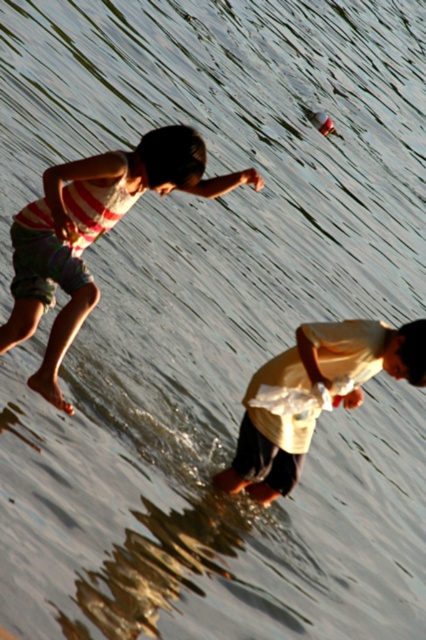
You are a photographer trying to capture the two children in the scene. The striped cotton shorts at left is located at point (x=92, y=232). Where should you position your camera to ensure both children are in frame?

To capture both children in frame, position the camera so that the striped cotton shorts at left at point (x=92, y=232) is within the camera view, ensuring the other child holding the plastic bottle is also visible.

You are a photographer trying to capture a photo of the striped cotton shorts at left and the yellow cotton shirt at lower right. If you want to ensure both items are in focus, which one should you focus on first considering their sizes?

The striped cotton shorts at left might be wider than yellow cotton shirt at lower right, so focusing on the larger object first would help ensure both are in focus.